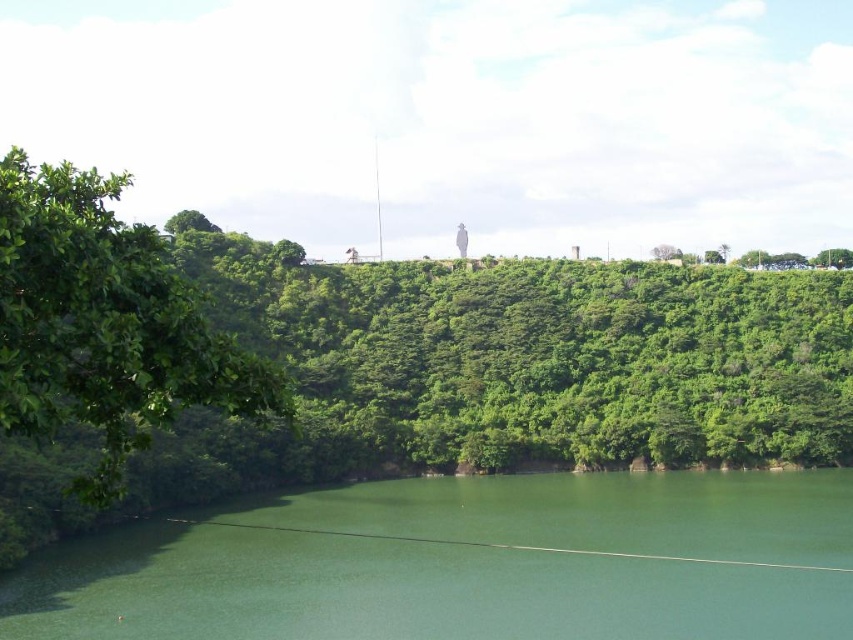
You are standing at the edge of the lake and see the green smooth water at center and the green leafy tree at left. Which object is closer to your right side?

The green smooth water at center is to the right of the green leafy tree at left, so the green smooth water at center is closer to your right side.

You are standing at the origin point of the image coordinate system. The origin is at the bottom left corner. The x and y axes increase to the right and up respectively. You want to locate the green smooth water at center. What are its coordinates?

The coordinates of the green smooth water at center are at point [468,563].

You are standing at the point marked by coordinates point (468, 563) in the serene natural landscape. Looking around, you see green smooth water at center. Can you confirm if you are currently standing on the green smooth water at center?

The point (468, 563) represents the green smooth water at center, so yes, you are standing on the green smooth water at center.